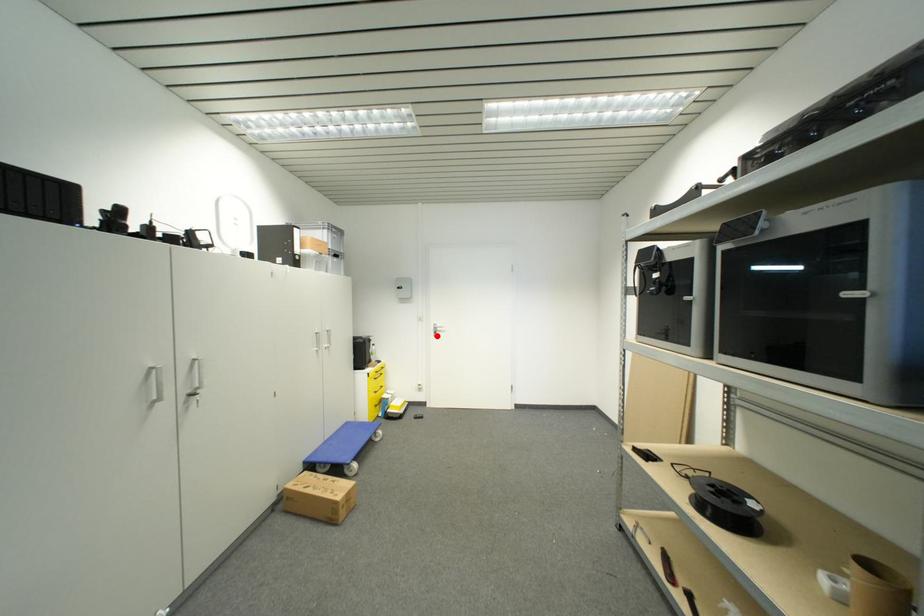
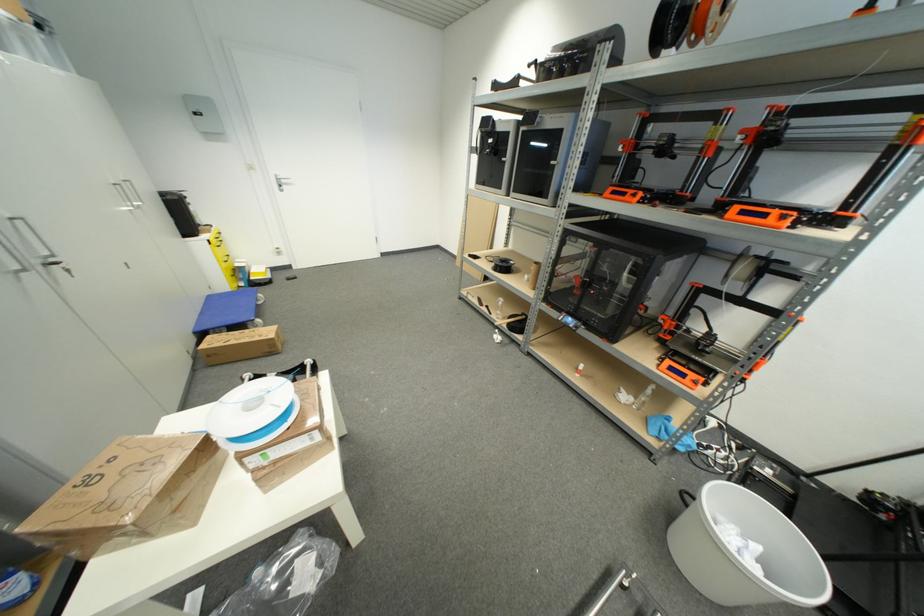
Locate, in the second image, the point that corresponds to the highlighted location in the first image.

(281, 188)